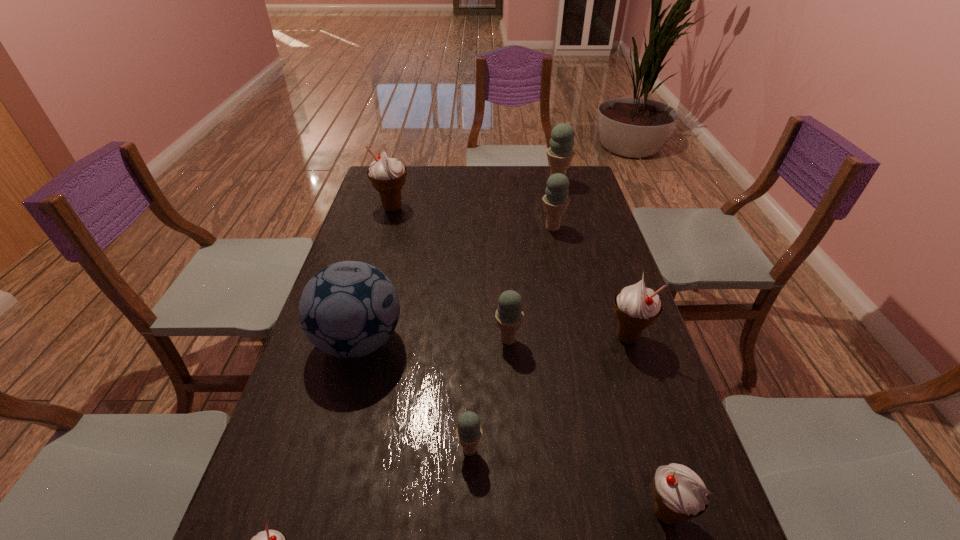
This screenshot has height=540, width=960. I want to click on vacant space located on the back of the third biggest blue ice cream, so click(504, 271).

This screenshot has width=960, height=540. Find the location of `free space located 0.050m on the right of the nearest blue ice cream`. free space located 0.050m on the right of the nearest blue ice cream is located at coordinates (506, 450).

Where is `object located in the far edge section of the desktop`? The height and width of the screenshot is (540, 960). object located in the far edge section of the desktop is located at coordinates (560, 153).

I want to click on icecream present at the left edge, so click(x=387, y=175).

I want to click on soccer ball located at the left edge, so click(349, 309).

Where is `object that is at the far right corner`? The height and width of the screenshot is (540, 960). object that is at the far right corner is located at coordinates (560, 153).

This screenshot has width=960, height=540. Identify the location of vacant space at the far edge of the desktop. (451, 173).

In the image, there is a desktop. Identify the location of free space at the left edge. (379, 252).

This screenshot has width=960, height=540. Identify the location of free space at the right edge of the desktop. (607, 229).

What are the coordinates of `vacant area at the far right corner of the desktop` in the screenshot? It's located at (568, 178).